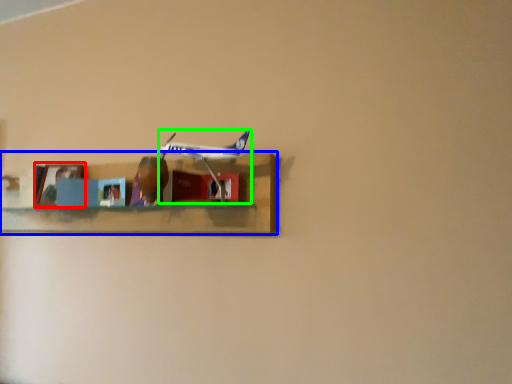
Question: Which is farther away from picture frame (highlighted by a red box)? shelf (highlighted by a blue box) or airplane (highlighted by a green box)?

Choices:
 (A) shelf
 (B) airplane

Answer: (B)